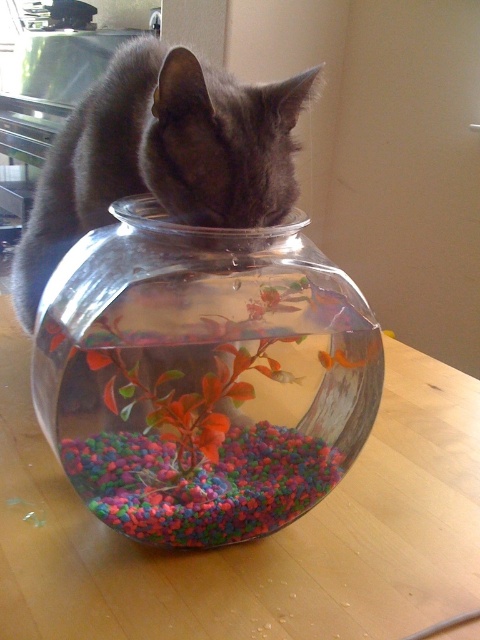
Which is in front, point (124, 467) or point (299, 381)?

Point (124, 467)

Is transparent glass bowl at center above orange matte fish at center?

Yes, transparent glass bowl at center is above orange matte fish at center.

Does point (194, 516) lie behind point (299, 380)?

No, it is in front of (299, 380).

Find the location of a particular element. The height and width of the screenshot is (640, 480). transparent glass bowl at center is located at coordinates (203, 376).

Is transparent glass bowl at center further to the viewer compared to gray fur cat at upper center?

No.

Based on the photo, does transparent glass bowl at center have a lesser width compared to gray fur cat at upper center?

Correct, transparent glass bowl at center's width is less than gray fur cat at upper center's.

Measure the distance between point (x=192, y=444) and camera.

Point (x=192, y=444) is 27.96 centimeters from camera.

Where is `transparent glass bowl at center`? Image resolution: width=480 pixels, height=640 pixels. transparent glass bowl at center is located at coordinates (203, 376).

Who is more distant from viewer, (264, 547) or (296, 378)?

Positioned behind is point (296, 378).

Image resolution: width=480 pixels, height=640 pixels. I want to click on wooden table at center, so click(257, 540).